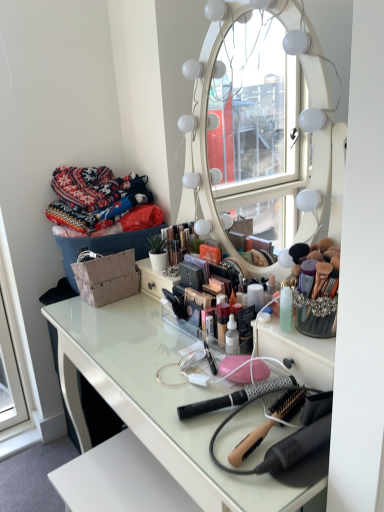
Question: Is white glossy table at center thinner than wooden-handled hairbrush at center, which is counted as the second brush, starting from the back?

Choices:
 (A) no
 (B) yes

Answer: (A)

Question: From a real-world perspective, is white glossy table at center physically above wooden-handled hairbrush at center, which is counted as the second brush, starting from the back?

Choices:
 (A) no
 (B) yes

Answer: (A)

Question: Is white glossy table at center to the right of wooden-handled hairbrush at center, which is the 1th brush in front-to-back order, from the viewer's perspective?

Choices:
 (A) no
 (B) yes

Answer: (A)

Question: Is white glossy table at center next to wooden-handled hairbrush at center, which is the 1th brush in front-to-back order, and touching it?

Choices:
 (A) no
 (B) yes

Answer: (A)

Question: Considering the relative sizes of white glossy table at center and wooden-handled hairbrush at center, which is counted as the second brush, starting from the back, in the image provided, is white glossy table at center wider than wooden-handled hairbrush at center, which is counted as the second brush, starting from the back,?

Choices:
 (A) yes
 (B) no

Answer: (A)

Question: Is white glossy table at center in front of wooden-handled hairbrush at center, which is counted as the second brush, starting from the back?

Choices:
 (A) no
 (B) yes

Answer: (B)

Question: Is black plastic brush at center, the 1th brush when ordered from back to front, shorter than wooden-handled hairbrush at center, which is the 1th brush in front-to-back order?

Choices:
 (A) yes
 (B) no

Answer: (A)

Question: Is the surface of black plastic brush at center, placed as the 2th brush when sorted from front to back, in direct contact with wooden-handled hairbrush at center, which is counted as the second brush, starting from the back?

Choices:
 (A) no
 (B) yes

Answer: (B)

Question: From a real-world perspective, is black plastic brush at center, the 1th brush when ordered from back to front, physically below wooden-handled hairbrush at center, which is counted as the second brush, starting from the back?

Choices:
 (A) yes
 (B) no

Answer: (A)

Question: Considering the relative sizes of black plastic brush at center, placed as the 2th brush when sorted from front to back, and wooden-handled hairbrush at center, which is counted as the second brush, starting from the back, in the image provided, is black plastic brush at center, placed as the 2th brush when sorted from front to back, wider than wooden-handled hairbrush at center, which is counted as the second brush, starting from the back,?

Choices:
 (A) yes
 (B) no

Answer: (A)

Question: Would you say wooden-handled hairbrush at center, which is counted as the second brush, starting from the back, is part of black plastic brush at center, the 1th brush when ordered from back to front,'s contents?

Choices:
 (A) no
 (B) yes

Answer: (A)

Question: From the image's perspective, would you say black plastic brush at center, placed as the 2th brush when sorted from front to back, is shown under wooden-handled hairbrush at center, which is counted as the second brush, starting from the back?

Choices:
 (A) yes
 (B) no

Answer: (B)

Question: Are white glossy table at center and knitted fabric sweater at upper left far apart?

Choices:
 (A) no
 (B) yes

Answer: (A)